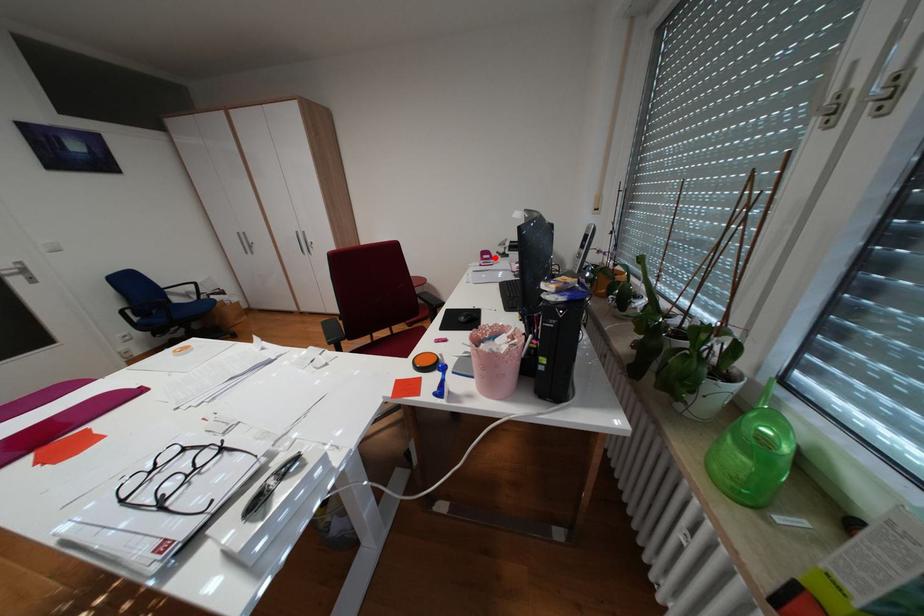
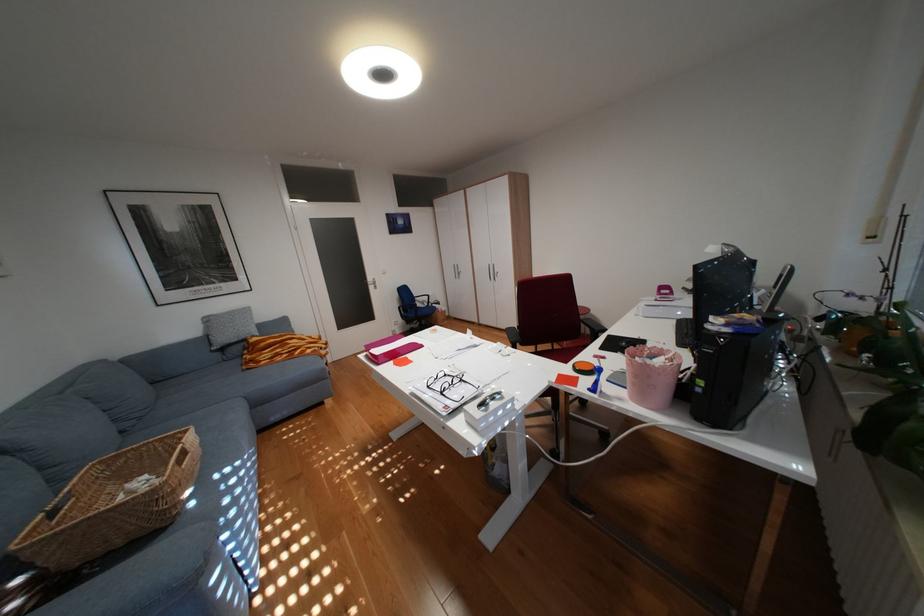
Find the pixel in the second image that matches the highlighted location in the first image.

(672, 293)